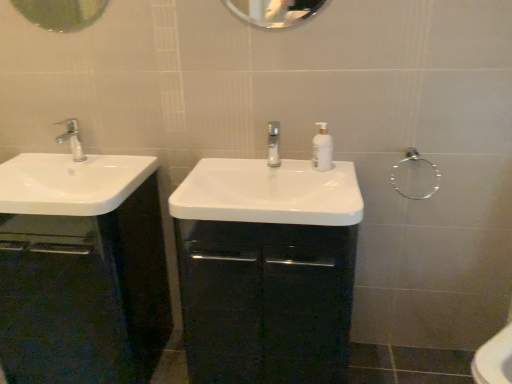
Question: Considering the relative sizes of clear glass tap at center, the 2th tap positioned from the left, and white glossy sink at center, which is the 2th sink from left to right, in the image provided, is clear glass tap at center, the 2th tap positioned from the left, taller than white glossy sink at center, which is the 2th sink from left to right,?

Choices:
 (A) yes
 (B) no

Answer: (A)

Question: From the image's perspective, would you say clear glass tap at center, the 1th tap from the right, is shown under white glossy sink at center, arranged as the 1th sink when viewed from the right?

Choices:
 (A) no
 (B) yes

Answer: (A)

Question: From a real-world perspective, does clear glass tap at center, the 1th tap from the right, stand above white glossy sink at center, which is the 2th sink from left to right?

Choices:
 (A) yes
 (B) no

Answer: (A)

Question: Is clear glass tap at center, the 2th tap positioned from the left, oriented away from white glossy sink at center, which is the 2th sink from left to right?

Choices:
 (A) no
 (B) yes

Answer: (A)

Question: Could you tell me if clear glass tap at center, the 2th tap positioned from the left, is facing white glossy sink at center, arranged as the 1th sink when viewed from the right?

Choices:
 (A) yes
 (B) no

Answer: (B)

Question: Relative to metallic circular mirror at upper left, which is the second mirror from right to left, is glossy black cabinet at center, arranged as the 1th bathroom cabinet when viewed from the right, in front or behind?

Choices:
 (A) behind
 (B) front

Answer: (B)

Question: Is glossy black cabinet at center, which is the 2th bathroom cabinet in left-to-right order, spatially inside metallic circular mirror at upper left, which is counted as the 1th mirror, starting from the left, or outside of it?

Choices:
 (A) outside
 (B) inside

Answer: (A)

Question: In terms of size, does glossy black cabinet at center, arranged as the 1th bathroom cabinet when viewed from the right, appear bigger or smaller than metallic circular mirror at upper left, which is the second mirror from right to left?

Choices:
 (A) big
 (B) small

Answer: (A)

Question: From the image's perspective, is glossy black cabinet at center, arranged as the 1th bathroom cabinet when viewed from the right, above or below metallic circular mirror at upper left, which is counted as the 1th mirror, starting from the left?

Choices:
 (A) above
 (B) below

Answer: (B)

Question: Considering the positions of point (81, 148) and point (275, 21), is point (81, 148) closer or farther from the camera than point (275, 21)?

Choices:
 (A) closer
 (B) farther

Answer: (B)

Question: Is silver metallic faucet at left, the 1th tap viewed from the left, taller or shorter than clear glass mirror at upper center, the second mirror viewed from the left?

Choices:
 (A) short
 (B) tall

Answer: (A)

Question: Is silver metallic faucet at left, the 1th tap viewed from the left, in front of or behind clear glass mirror at upper center, the first mirror when ordered from right to left, in the image?

Choices:
 (A) front
 (B) behind

Answer: (B)

Question: Choose the correct answer: Is silver metallic faucet at left, the 1th tap viewed from the left, inside clear glass mirror at upper center, the second mirror viewed from the left, or outside it?

Choices:
 (A) inside
 (B) outside

Answer: (B)

Question: Considering their positions, is white glossy sink at center, arranged as the 1th sink when viewed from the right, located in front of or behind clear glass mirror at upper center, the second mirror viewed from the left?

Choices:
 (A) front
 (B) behind

Answer: (A)

Question: From their relative heights in the image, would you say white glossy sink at center, which is the 2th sink from left to right, is taller or shorter than clear glass mirror at upper center, the second mirror viewed from the left?

Choices:
 (A) short
 (B) tall

Answer: (A)